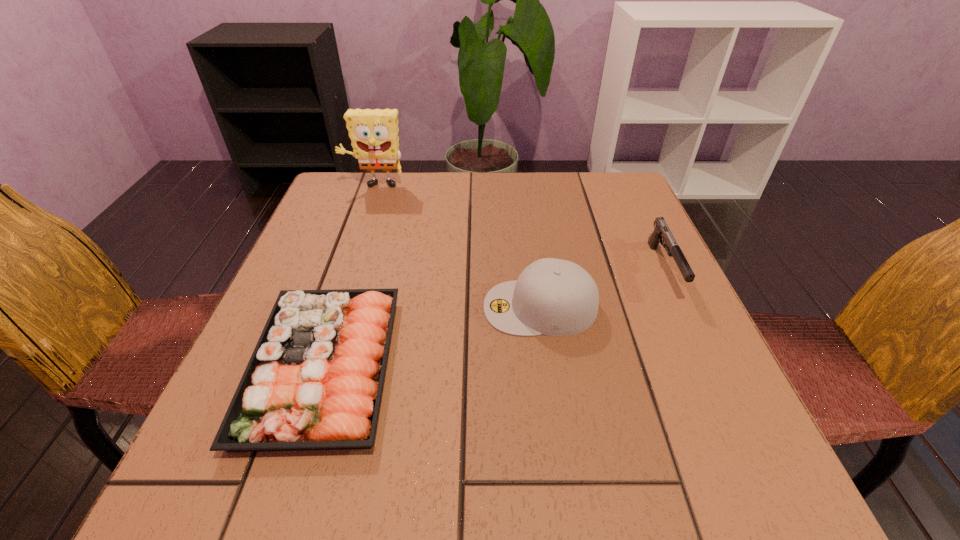
Where is `vacant space at the left edge of the desktop`? The width and height of the screenshot is (960, 540). vacant space at the left edge of the desktop is located at coordinates [x=306, y=283].

Image resolution: width=960 pixels, height=540 pixels. I want to click on free spot at the right edge of the desktop, so click(664, 293).

Identify the location of vacant space at the far left corner of the desktop. (346, 194).

This screenshot has width=960, height=540. Identify the location of vacant space at the near left corner of the desktop. (232, 501).

What are the coordinates of `vacant space at the far right corner` in the screenshot? It's located at (591, 192).

In order to click on vacant point at the near right corner in this screenshot , I will do (x=722, y=453).

Where is `vacant area that lies between the second object from right to left and the third tallest object`? The image size is (960, 540). vacant area that lies between the second object from right to left and the third tallest object is located at coordinates (602, 288).

The height and width of the screenshot is (540, 960). Find the location of `vacant space that's between the sponge and the platter`. vacant space that's between the sponge and the platter is located at coordinates (349, 276).

In order to click on vacant area that lies between the farthest object and the third object from left to right in this screenshot , I will do `click(457, 247)`.

At what (x,y) coordinates should I click in order to perform the action: click on empty space that is in between the third object from left to right and the third tallest object. Please return your answer as a coordinate pair (x, y). The height and width of the screenshot is (540, 960). Looking at the image, I should click on (602, 288).